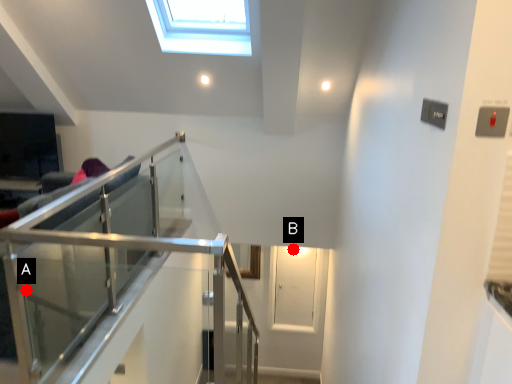
Question: Two points are circled on the image, labeled by A and B beside each circle. Which point is closer to the camera?

Choices:
 (A) A is closer
 (B) B is closer

Answer: (A)